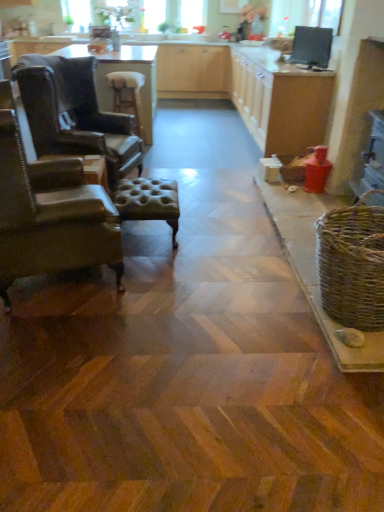
Question: From a real-world perspective, relative to matte wood counter top at center, is brown leather stool at center, which is the 2th stool from front to back, vertically above or below?

Choices:
 (A) below
 (B) above

Answer: (A)

Question: Does point (119, 74) appear closer or farther from the camera than point (284, 108)?

Choices:
 (A) closer
 (B) farther

Answer: (B)

Question: Estimate the real-world distances between objects in this image. Which object is farther from the leather armchair at left, which is the 1th chair from front to back?

Choices:
 (A) leather tufted stool at center, the 1th stool positioned from the right
 (B) woven brown basket at right
 (C) leather wingback chair at left, which is the 1th chair in back-to-front order
 (D) brown leather stool at center, which is the 2th stool from front to back
 (E) light brown wooden table at center

Answer: (E)

Question: Which object is positioned farthest from the wooden cabinet at center?

Choices:
 (A) woven brown basket at right
 (B) matte wood counter top at center
 (C) leather armchair at left, the second chair viewed from the back
 (D) leather wingback chair at left, the second chair when ordered from front to back
 (E) leather tufted stool at center, the 1th stool positioned from the right

Answer: (C)